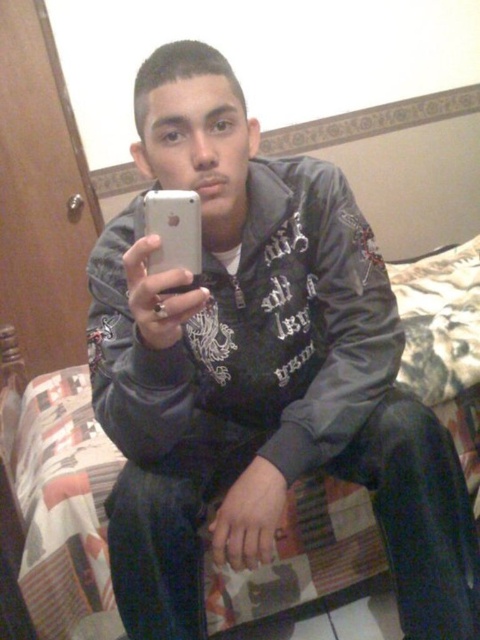
You are a photographer setting up a shoot in the room. You need to place a small tripod between the matte black leather jacket at center and the silver metallic phone at center. Based on their positions, which side of the phone should the tripod be placed on?

The matte black leather jacket at center is positioned on the right side of the silver metallic phone at center, so the tripod should be placed to the right of the silver metallic phone at center to be between them.

You are a fashion designer trying to identify the exact location of the matte black leather jacket in the image. The coordinates provided are in normalized image coordinates. Can you confirm if the point at coordinates point (252, 336) is indeed the center of the matte black leather jacket?

Yes, the point at coordinates point (252, 336) marks the center of the matte black leather jacket.

You are a photographer setting up for a closeup shot of the matte black leather jacket at center. The camera is currently positioned 30 inches away. Do you need to move closer or farther to ensure the jacket fills the frame properly?

The matte black leather jacket at center is 29.59 inches away from the camera. Since the camera is set at 30 inches, you should move slightly closer by 0.41 inches to align with the jacket distance for proper framing.